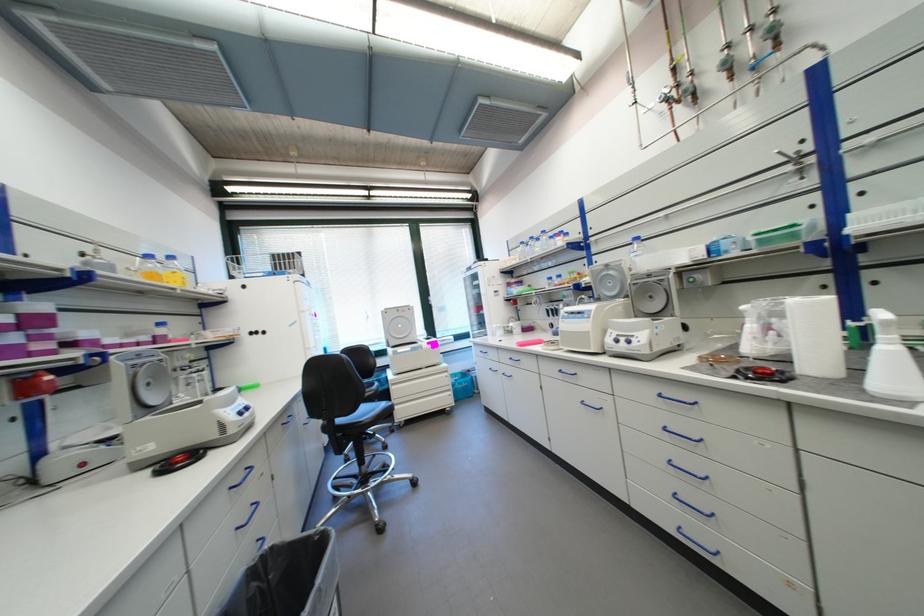
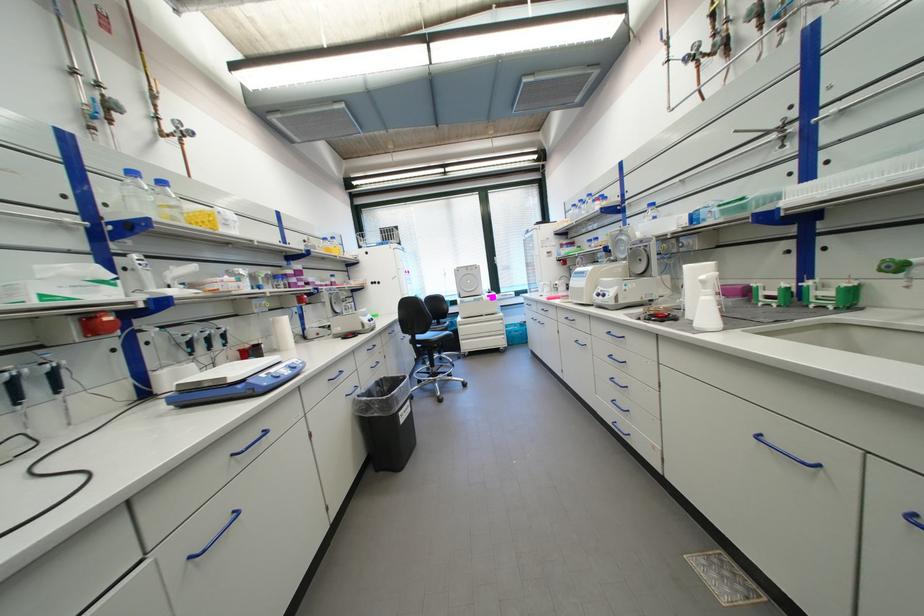
In the second image, find the point that corresponds to pixel 347 421 in the first image.

(427, 338)